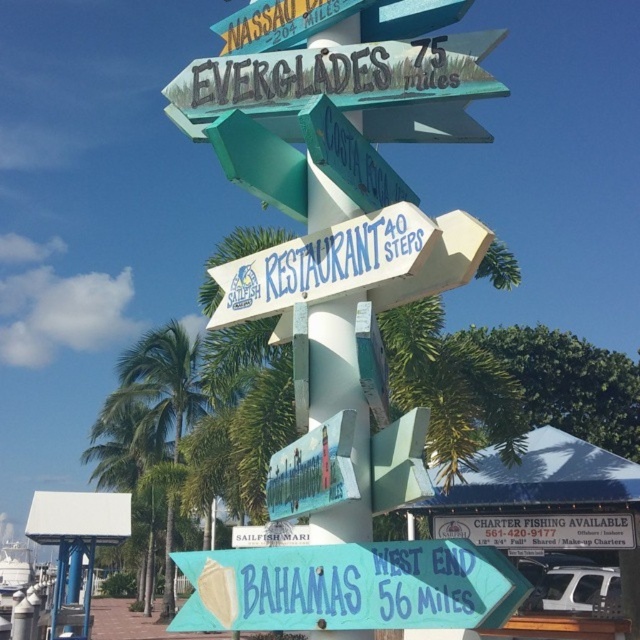
Question: Based on their relative distances, which object is farther from the teal matte signpost at lower center?

Choices:
 (A) white plastic sign at lower center
 (B) green painted wooden signpost at upper center
 (C) green leafy palm tree at left

Answer: (C)

Question: Estimate the real-world distances between objects in this image. Which object is closer to the teal matte signpost at lower center?

Choices:
 (A) white plastic sign at lower center
 (B) green painted wooden signpost at upper center
 (C) blue painted wooden sign at center
 (D) green leafy palm tree at left

Answer: (C)

Question: Does green painted wooden signpost at upper center lie behind green leafy palm tree at left?

Choices:
 (A) yes
 (B) no

Answer: (B)

Question: Which point appears farthest from the camera in this image?

Choices:
 (A) (280, 492)
 (B) (196, 364)
 (C) (404, 61)

Answer: (B)

Question: Does teal matte signpost at lower center appear on the left side of green leafy palm tree at left?

Choices:
 (A) no
 (B) yes

Answer: (A)

Question: Is green painted wooden signpost at upper center above blue painted wooden sign at center?

Choices:
 (A) yes
 (B) no

Answer: (A)